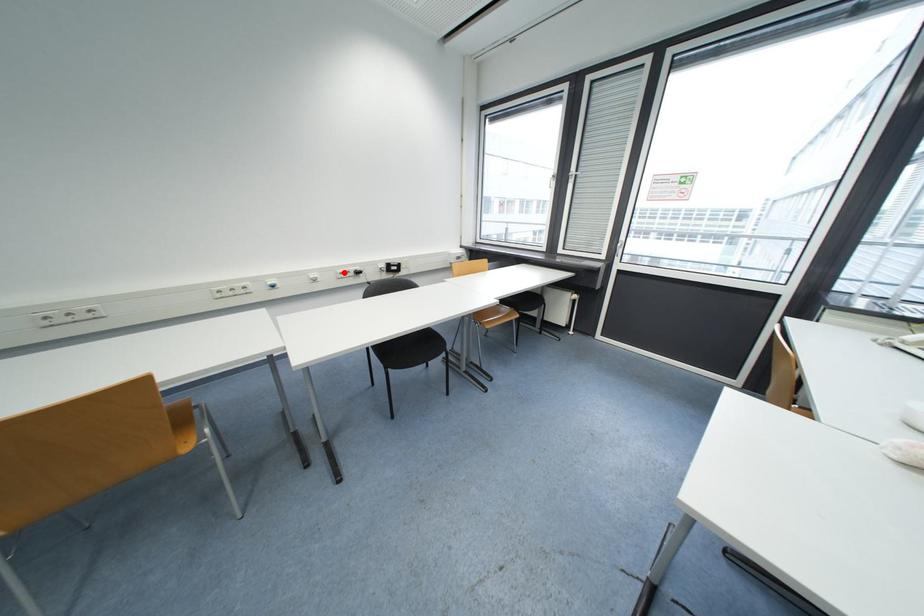
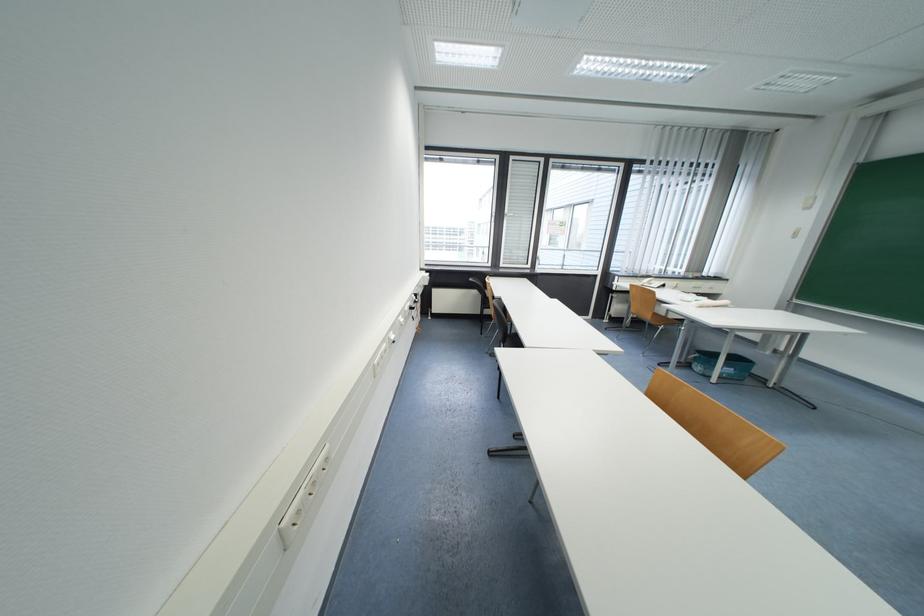
Question: A red point is marked in image1. In image2, is the corresponding 3D point closer to the camera or farther? Reply with the corresponding letter.

Choices:
 (A) The corresponding 3D point is closer.
 (B) The corresponding 3D point is farther.

Answer: (A)